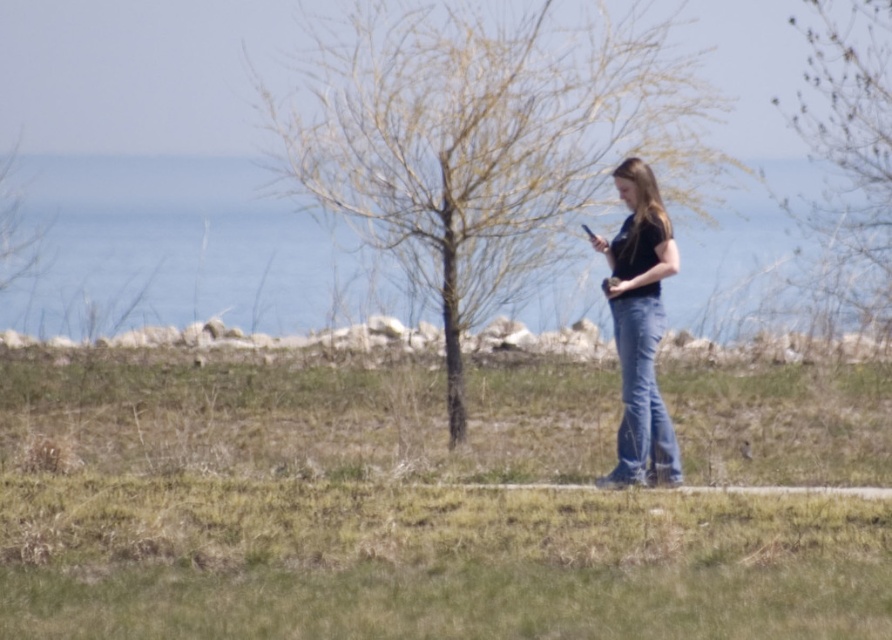
Question: Is blue jeans at lower center to the left of blue denim jeans at center from the viewer's perspective?

Choices:
 (A) yes
 (B) no

Answer: (A)

Question: Considering the relative positions of blue jeans at lower center and bare branches at upper right in the image provided, where is blue jeans at lower center located with respect to bare branches at upper right?

Choices:
 (A) above
 (B) below

Answer: (B)

Question: Which point is farther to the camera?

Choices:
 (A) (18, 499)
 (B) (882, 275)
 (C) (589, 170)

Answer: (B)

Question: Which point is farther from the camera taking this photo?

Choices:
 (A) (639, 368)
 (B) (830, 97)
 (C) (622, 586)
 (D) (680, 481)

Answer: (B)

Question: Which object is closer to the camera taking this photo?

Choices:
 (A) bare branches at upper right
 (B) bare branches at center
 (C) blue jeans at lower center

Answer: (C)

Question: Can you confirm if blue jeans at lower center is positioned above bare branches at upper right?

Choices:
 (A) no
 (B) yes

Answer: (A)